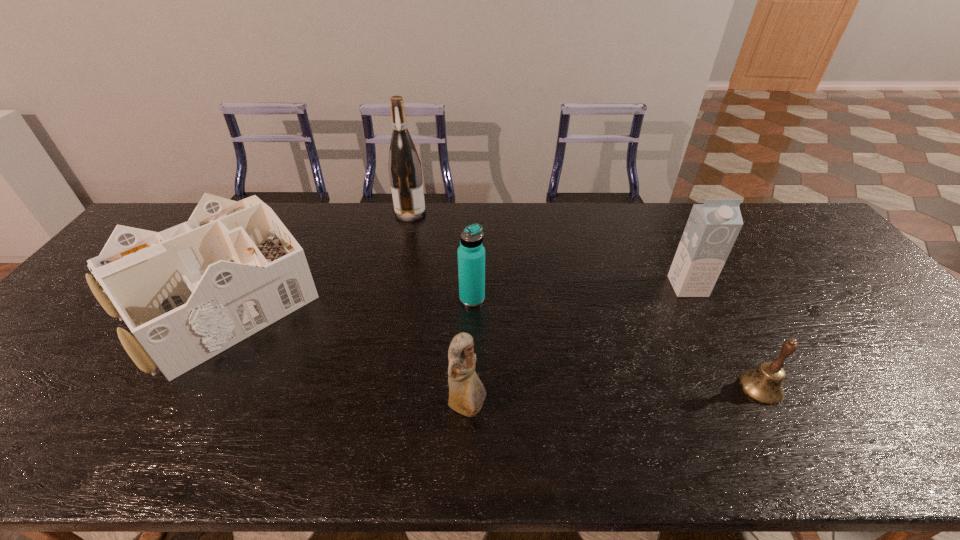
This screenshot has height=540, width=960. Identify the location of the second object from left to right. (404, 165).

The width and height of the screenshot is (960, 540). What are the coordinates of `the farthest object` in the screenshot? It's located at (404, 165).

This screenshot has width=960, height=540. I want to click on the second tallest object, so click(712, 228).

Image resolution: width=960 pixels, height=540 pixels. I want to click on dollhouse, so click(x=187, y=293).

The height and width of the screenshot is (540, 960). Find the location of `water bottle`. water bottle is located at coordinates (471, 253).

Identify the location of figurine. Image resolution: width=960 pixels, height=540 pixels. (467, 393).

Where is `bell`? The width and height of the screenshot is (960, 540). bell is located at coordinates (764, 385).

Identify the location of free space located 0.310m on the left of the tallest object. (306, 213).

Identify the location of free space located 0.340m on the front label of the second tallest object. The width and height of the screenshot is (960, 540). (748, 405).

At what (x,y) coordinates should I click in order to perform the action: click on vacant space located 0.130m on the front of the leftmost object. Please return your answer as a coordinate pair (x, y). The width and height of the screenshot is (960, 540). Looking at the image, I should click on [x=143, y=434].